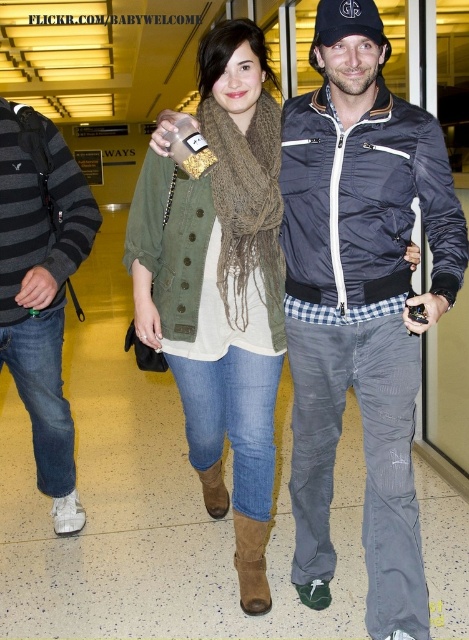
Does brown knitted scarf at center have a larger size compared to striped knit sweater at left?

Yes.

This screenshot has width=469, height=640. Describe the element at coordinates (220, 285) in the screenshot. I see `brown knitted scarf at center` at that location.

The height and width of the screenshot is (640, 469). In order to click on brown knitted scarf at center in this screenshot , I will do `click(220, 285)`.

Looking at this image, is striped knit sweater at left behind black cap at upper center?

Yes, it is.

Which is above, striped knit sweater at left or black cap at upper center?

black cap at upper center

Does point (68, 147) come closer to viewer compared to point (367, 1)?

No, it is not.

At what (x,y) coordinates should I click in order to perform the action: click on striped knit sweater at left. Please return your answer as a coordinate pair (x, y). The width and height of the screenshot is (469, 640). Looking at the image, I should click on (42, 289).

Is matte blue bomber jacket at center taller than brown knitted scarf at center?

No, matte blue bomber jacket at center is not taller than brown knitted scarf at center.

Who is higher up, matte blue bomber jacket at center or brown knitted scarf at center?

brown knitted scarf at center

Which is in front, point (369, 225) or point (279, 141)?

Point (369, 225)

Where is `matte blue bomber jacket at center`? This screenshot has height=640, width=469. matte blue bomber jacket at center is located at coordinates (362, 314).